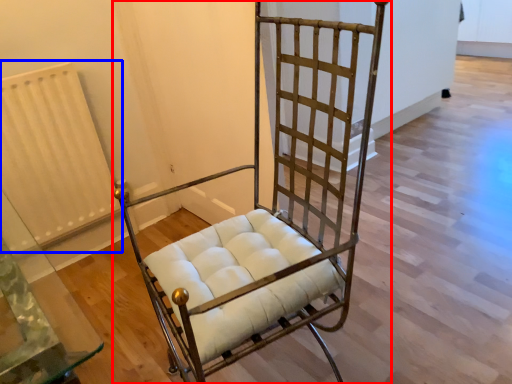
Question: Which point is further to the camera, furniture (highlighted by a red box) or radiator (highlighted by a blue box)?

Choices:
 (A) furniture
 (B) radiator

Answer: (B)